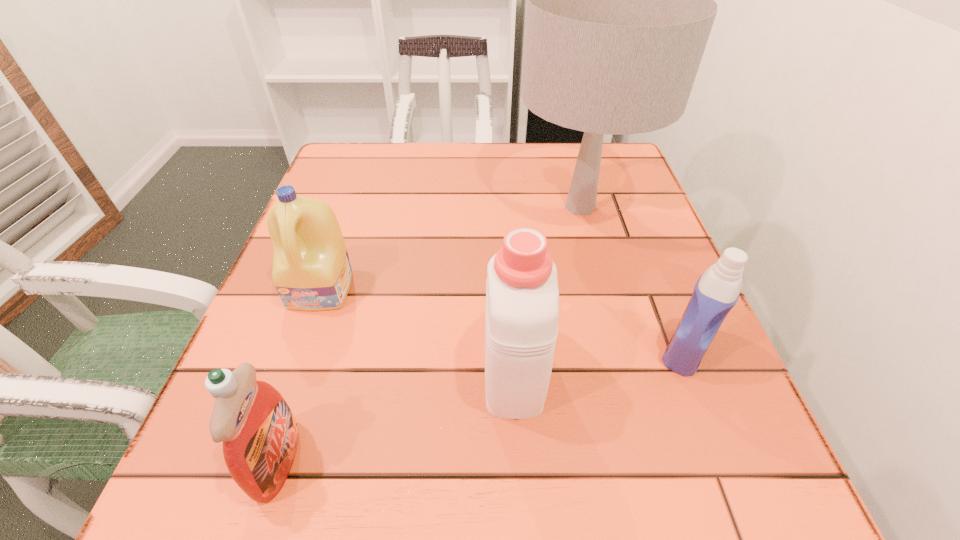
Find the location of a particular element. The image size is (960, 540). free space at the far edge is located at coordinates (456, 178).

In the image, there is a desktop. At what (x,y) coordinates should I click in order to perform the action: click on blank space at the near edge. Please return your answer as a coordinate pair (x, y). The width and height of the screenshot is (960, 540). Looking at the image, I should click on (494, 524).

What are the coordinates of `free space at the left edge of the desktop` in the screenshot? It's located at (361, 199).

At what (x,y) coordinates should I click in order to perform the action: click on free space at the right edge of the desktop. Please return your answer as a coordinate pair (x, y). This screenshot has height=540, width=960. Looking at the image, I should click on (723, 433).

In order to click on free location at the far left corner of the desktop in this screenshot , I will do pyautogui.click(x=359, y=156).

Find the location of a particular element. Image resolution: width=960 pixels, height=540 pixels. blank area at the near right corner is located at coordinates (735, 500).

Find the location of a particular element. free space between the rightmost detergent and the farthest object is located at coordinates (633, 279).

Identify the location of free spot between the farthest detergent and the fourth shortest object. This screenshot has width=960, height=540. (418, 328).

I want to click on empty location between the lampshade and the rightmost detergent, so click(633, 279).

Find the location of a particular element. This screenshot has height=540, width=960. empty location between the fourth shortest object and the rightmost detergent is located at coordinates (599, 359).